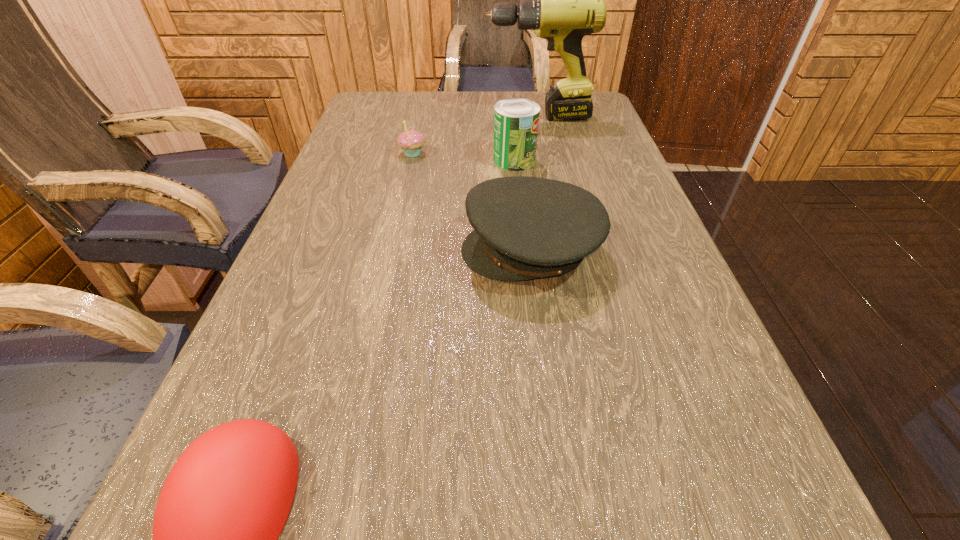
You are a GUI agent. You are given a task and a screenshot of the screen. Output one action in this format:
    pyautogui.click(x=<x>, y=<y>)
    Task: Click on the drill
    The width and height of the screenshot is (960, 540).
    Given the screenshot: What is the action you would take?
    pyautogui.click(x=561, y=0)

The height and width of the screenshot is (540, 960). Find the location of `the tallest object`. the tallest object is located at coordinates (561, 0).

The width and height of the screenshot is (960, 540). I want to click on can, so 516,120.

You are a GUI agent. You are given a task and a screenshot of the screen. Output one action in this format:
    pyautogui.click(x=<x>, y=<y>)
    Task: Click on the beret
    Image resolution: width=960 pixels, height=540 pixels.
    Given the screenshot: What is the action you would take?
    pyautogui.click(x=525, y=228)

The width and height of the screenshot is (960, 540). Identify the location of the second object from left to right. (411, 141).

The image size is (960, 540). I want to click on free space located on the handle side of the drill, so click(x=394, y=117).

This screenshot has width=960, height=540. Identify the location of vacant space situated 0.050m on the handle side of the drill. (468, 117).

This screenshot has width=960, height=540. What are the coordinates of `free space located 0.290m on the handle side of the drill` in the screenshot? It's located at (387, 117).

Identify the location of free region located on the front of the can. The height and width of the screenshot is (540, 960). (523, 244).

At what (x,y) coordinates should I click in order to perform the action: click on vacant space positioned 0.130m on the front-facing side of the beret. Please return your answer as a coordinate pair (x, y). Looking at the image, I should click on (396, 250).